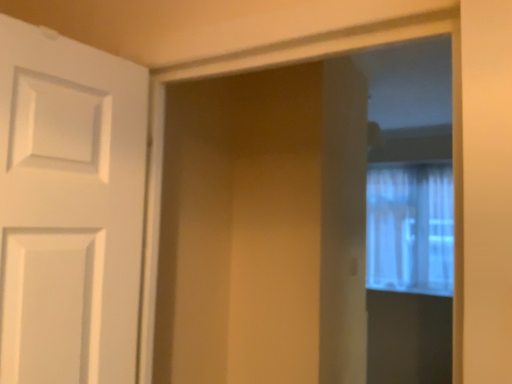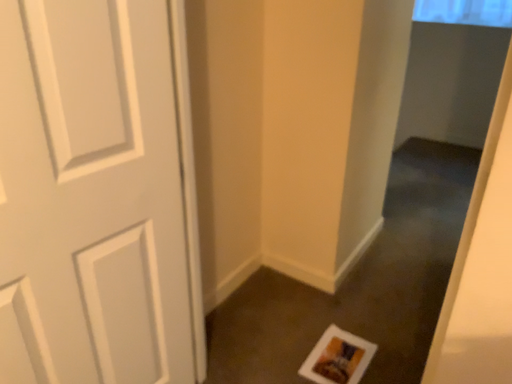
Question: How did the camera likely rotate when shooting the video?

Choices:
 (A) rotated downward
 (B) rotated upward

Answer: (A)